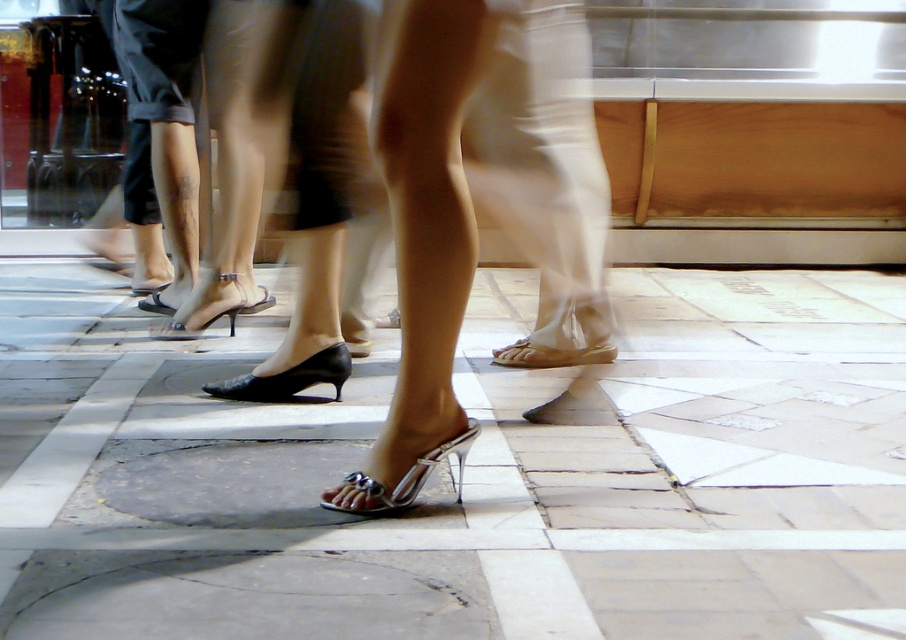
You are a photographer trying to capture a detailed shot of the metallic silver sandals at center. Since the white stone pavement at center is in the way, do you need to adjust your camera angle to focus on the sandals?

The white stone pavement at center is bigger than metallic silver sandals at center, so it may block the view. You should adjust your camera angle to focus on the metallic silver sandals at center.

You are a designer trying to place a decorative stone on the white stone pavement at center. The metallic silver sandals at center are currently occupying the space. Which object is shorter and therefore can be placed without exceeding the height of the other?

The white stone pavement at center is shorter than metallic silver sandals at center, so placing the decorative stone on the white stone pavement at center would not exceed the height of the metallic silver sandals at center.